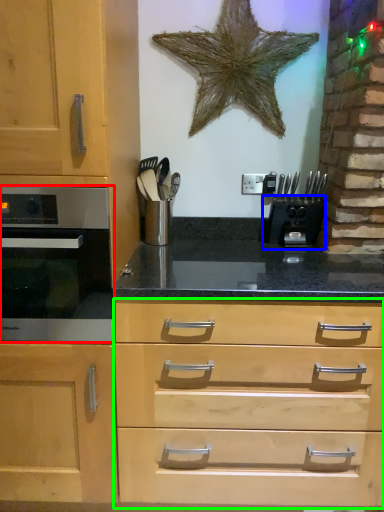
Question: Which object is positioned closest to oven (highlighted by a red box)? Select from coffee machine (highlighted by a blue box) and drawer (highlighted by a green box).

Choices:
 (A) coffee machine
 (B) drawer

Answer: (B)